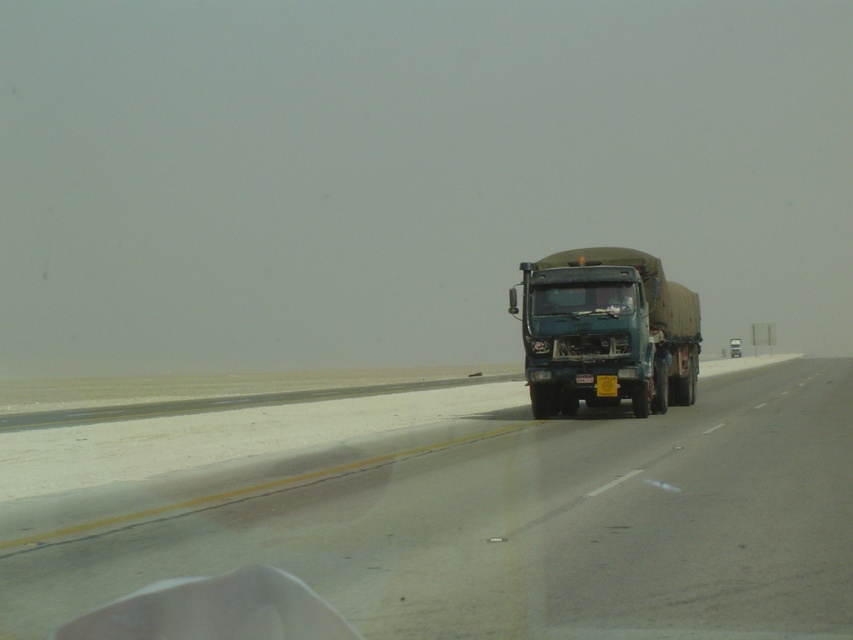
Question: Which of the following is the closest to the observer?

Choices:
 (A) (538, 305)
 (B) (97, 531)

Answer: (B)

Question: Can you confirm if smooth asphalt highway at center is positioned below transparent glass windshield at center?

Choices:
 (A) yes
 (B) no

Answer: (A)

Question: Among these points, which one is farthest from the camera?

Choices:
 (A) click(675, 307)
 (B) click(602, 305)
 (C) click(71, 522)

Answer: (A)

Question: Does smooth asphalt highway at center appear under green matte truck at center?

Choices:
 (A) yes
 (B) no

Answer: (A)

Question: Which object appears farthest from the camera in this image?

Choices:
 (A) green matte truck at center
 (B) transparent glass windshield at center
 (C) smooth asphalt highway at center

Answer: (B)

Question: Can you confirm if green matte truck at center is positioned above transparent glass windshield at center?

Choices:
 (A) no
 (B) yes

Answer: (A)